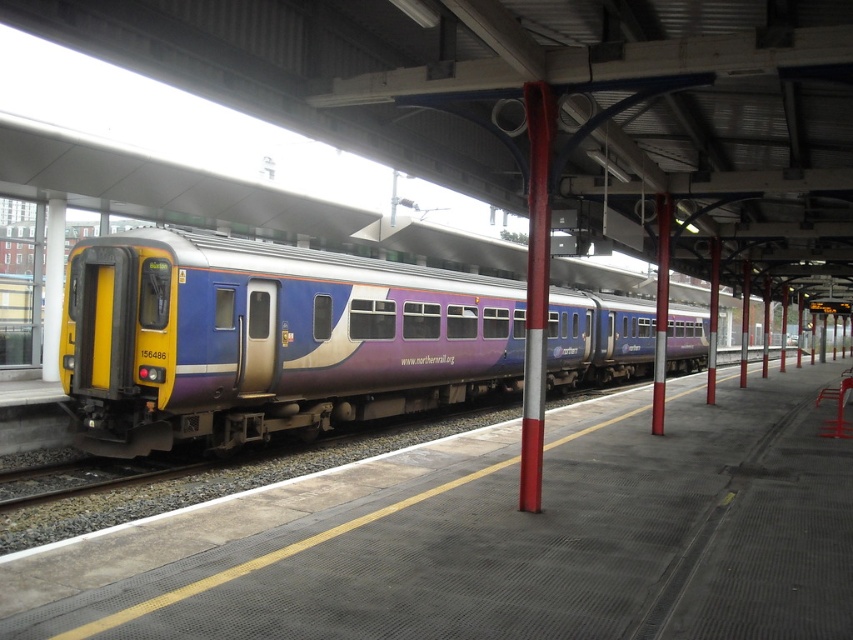
The width and height of the screenshot is (853, 640). Find the location of `purple glossy train at center`. purple glossy train at center is located at coordinates (x=270, y=339).

Is purple glossy train at center closer to the viewer compared to metallic pole at center?

Yes, it is.

Describe the element at coordinates (270, 339) in the screenshot. Image resolution: width=853 pixels, height=640 pixels. I see `purple glossy train at center` at that location.

Image resolution: width=853 pixels, height=640 pixels. I want to click on purple glossy train at center, so click(270, 339).

Can you confirm if red metallic pole at center is taller than metallic red pole at center?

No.

At what (x,y) coordinates should I click in order to perform the action: click on red metallic pole at center. Please return your answer as a coordinate pair (x, y). Looking at the image, I should click on (535, 289).